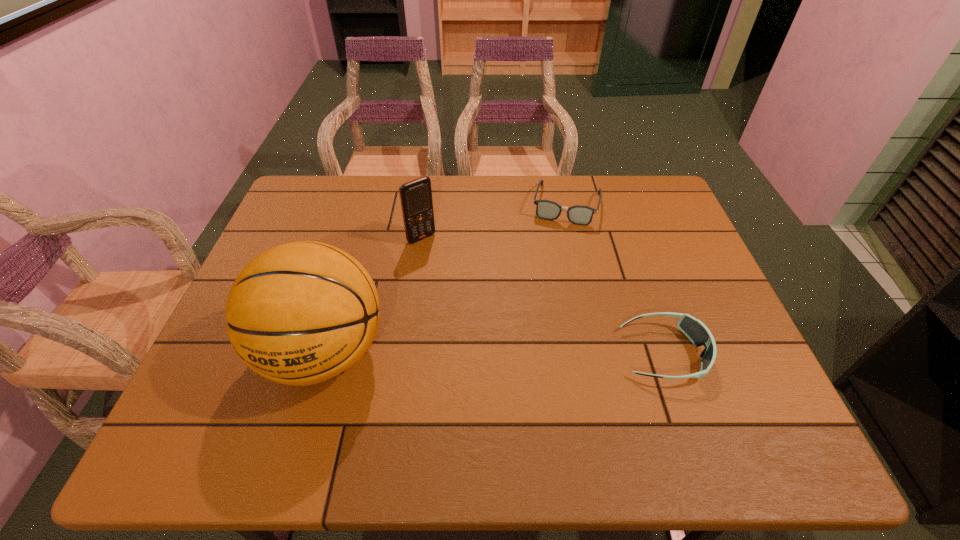
At what (x,y) coordinates should I click in order to perform the action: click on object that is the second closest to the basketball. Please return your answer as a coordinate pair (x, y). The height and width of the screenshot is (540, 960). Looking at the image, I should click on (581, 215).

Choose which object is the nearest neighbor to the basketball. Please provide its 2D coordinates. Your answer should be formatted as a tuple, i.e. [(x, y)], where the tuple contains the x and y coordinates of a point satisfying the conditions above.

[(416, 200)]

Locate an element on the screen. vacant space that satisfies the following two spatial constraints: 1. on the surface of the goggles near the brand logo; 2. on the front-facing side of the basketball is located at coordinates (324, 354).

The width and height of the screenshot is (960, 540). In order to click on free space that satisfies the following two spatial constraints: 1. on the surface of the goggles near the brand logo; 2. on the front-facing side of the basketball in this screenshot , I will do `click(324, 354)`.

At what (x,y) coordinates should I click in order to perform the action: click on vacant region that satisfies the following two spatial constraints: 1. on the front side of the spectacles; 2. on the front-facing side of the goggles. Please return your answer as a coordinate pair (x, y). Looking at the image, I should click on (601, 354).

Locate an element on the screen. This screenshot has height=540, width=960. free spot that satisfies the following two spatial constraints: 1. on the front side of the goggles; 2. on the front-facing side of the third shortest object is located at coordinates (405, 354).

Locate an element on the screen. This screenshot has width=960, height=540. free space that satisfies the following two spatial constraints: 1. on the surface of the goggles near the brand logo; 2. on the front-facing side of the basketball is located at coordinates (324, 354).

I want to click on vacant space that satisfies the following two spatial constraints: 1. on the surface of the basketball near the brand logo; 2. on the front-facing side of the goggles, so click(324, 354).

At what (x,y) coordinates should I click in order to perform the action: click on free point that satisfies the following two spatial constraints: 1. on the back side of the farthest object; 2. on the left side of the third nearest object. Please return your answer as a coordinate pair (x, y). Looking at the image, I should click on (426, 204).